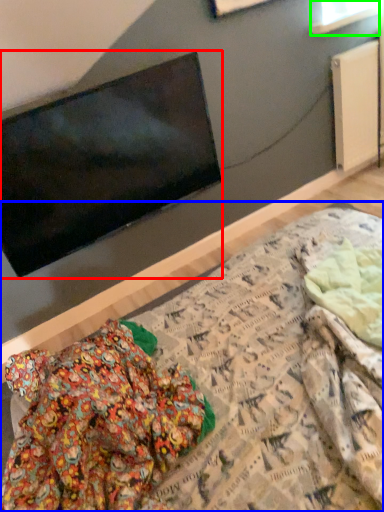
Question: Which object is positioned farthest from television (highlighted by a red box)? Select from bed (highlighted by a blue box) and window (highlighted by a green box).

Choices:
 (A) bed
 (B) window

Answer: (B)